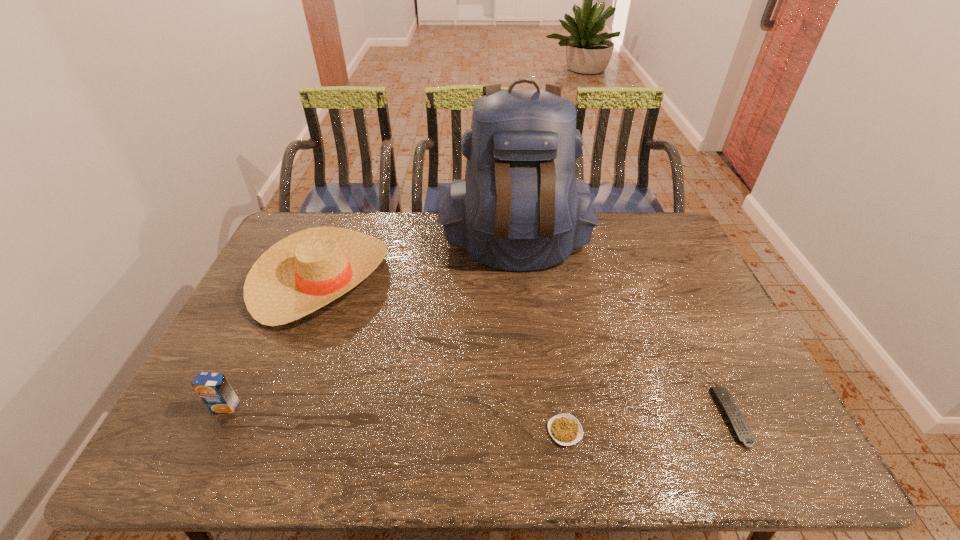
Where is `unoccupied position between the orange_juice and the backpack`? The height and width of the screenshot is (540, 960). unoccupied position between the orange_juice and the backpack is located at coordinates (372, 325).

Identify the location of free space between the shortest object and the remote control. The image size is (960, 540). (648, 424).

Find the location of `vacant area between the orange_juice and the sunhat`. vacant area between the orange_juice and the sunhat is located at coordinates (274, 342).

Where is `free spot between the legume and the orange_juice`? The width and height of the screenshot is (960, 540). free spot between the legume and the orange_juice is located at coordinates (396, 418).

Select which object is the third closest to the legume. Please provide its 2D coordinates. Your answer should be formatted as a tuple, i.e. [(x, y)], where the tuple contains the x and y coordinates of a point satisfying the conditions above.

[(305, 271)]

Where is `object that is the second nearest to the remote control`? This screenshot has width=960, height=540. object that is the second nearest to the remote control is located at coordinates (520, 207).

Image resolution: width=960 pixels, height=540 pixels. Find the location of `free space that satisfies the following two spatial constraints: 1. at the front pocket of the rightmost object; 2. on the right side of the tallest object`. free space that satisfies the following two spatial constraints: 1. at the front pocket of the rightmost object; 2. on the right side of the tallest object is located at coordinates (535, 417).